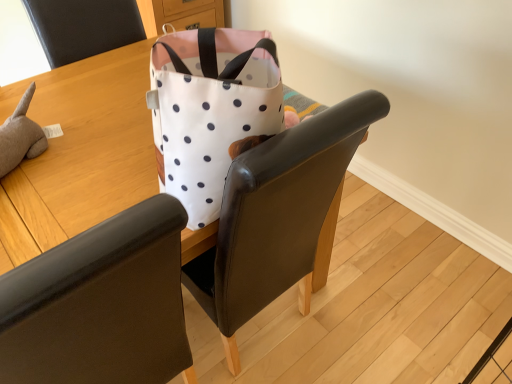
Question: From a real-world perspective, is white fabric bag at upper center above or below matte black chair at upper left, which ranks as the 2th chair in bottom-to-top order?

Choices:
 (A) below
 (B) above

Answer: (A)

Question: Is point (13, 228) positioned closer to the camera than point (88, 3)?

Choices:
 (A) farther
 (B) closer

Answer: (B)

Question: Which object is positioned farthest from the white fabric bag at upper center?

Choices:
 (A) matte black chair at upper left, which is the first chair in top-to-bottom order
 (B) white fabric chair at upper center, arranged as the 2th chair when viewed from the top

Answer: (B)

Question: Which is nearer to the white fabric chair at upper center, arranged as the 2th chair when viewed from the top?

Choices:
 (A) white fabric bag at upper center
 (B) matte black chair at upper left, which is the first chair in top-to-bottom order

Answer: (A)